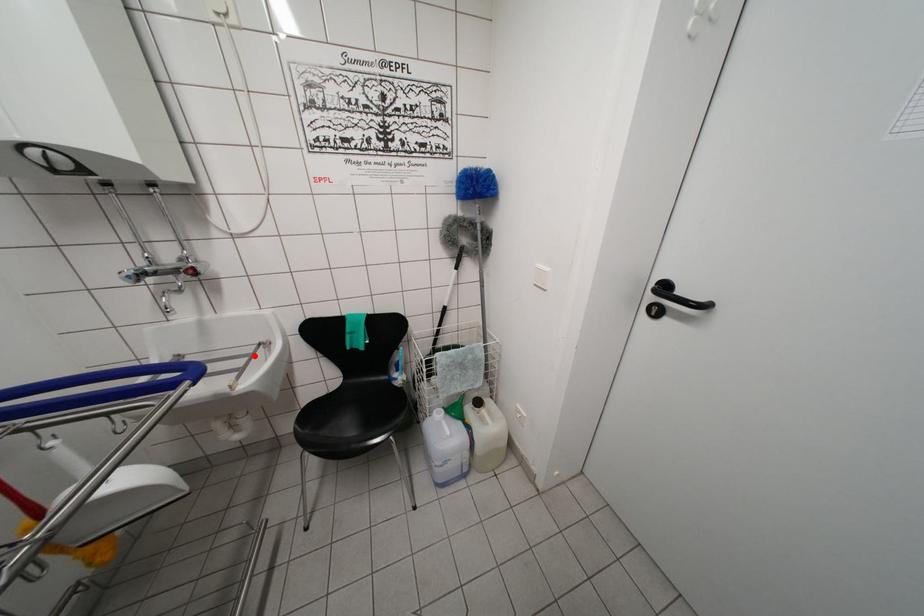
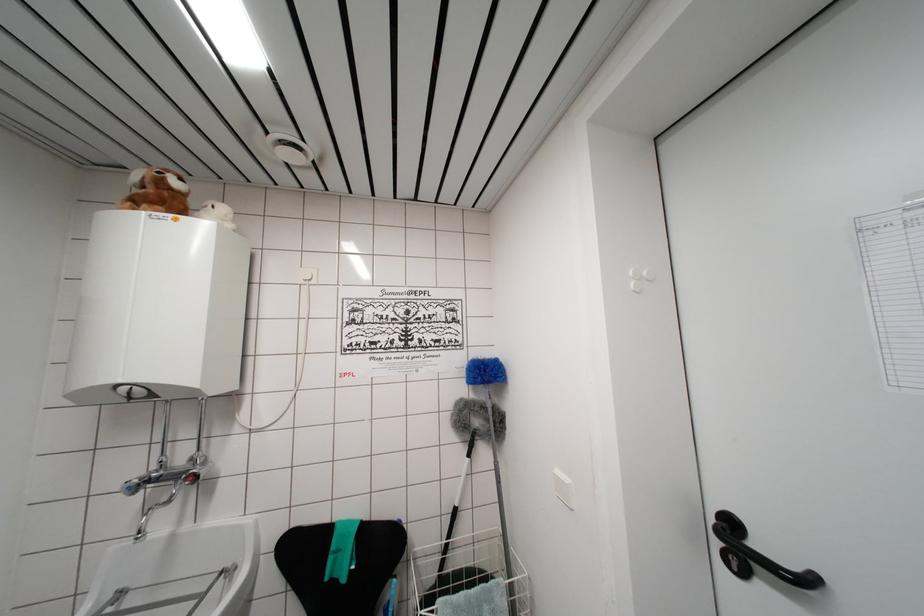
Locate, in the second image, the point that corresponds to the highlighted location in the first image.

(209, 593)